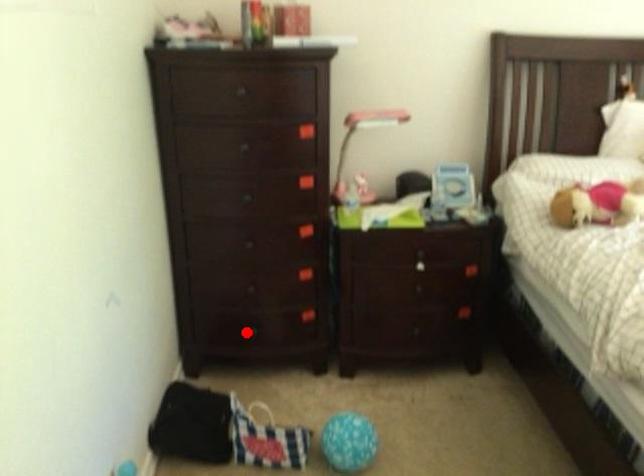
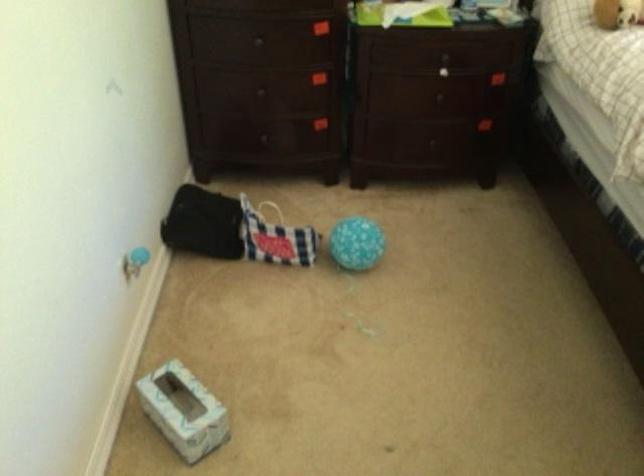
Find the pixel in the second image that matches the highlighted location in the first image.

(263, 138)